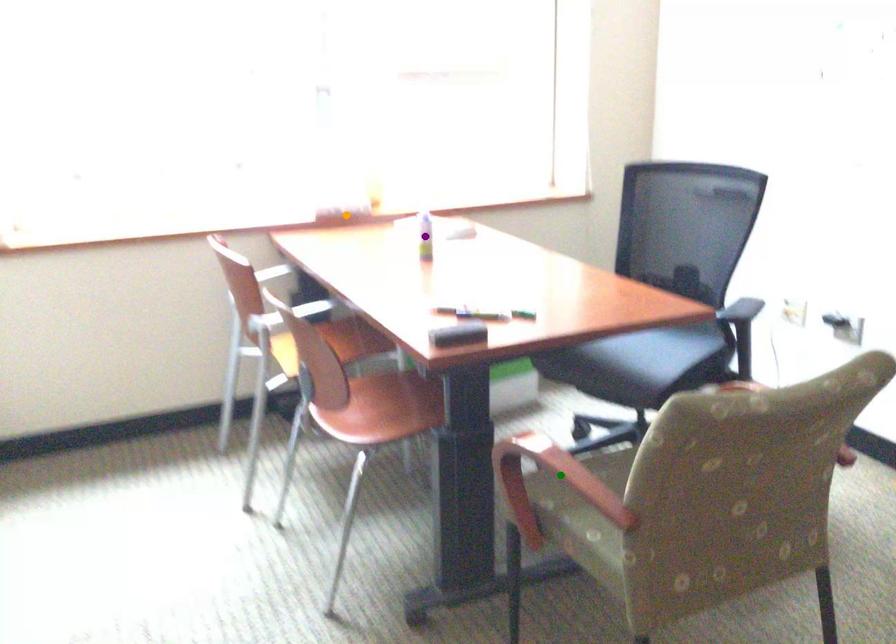
Order these from nearest to farthest:
purple point | orange point | green point

green point → purple point → orange point